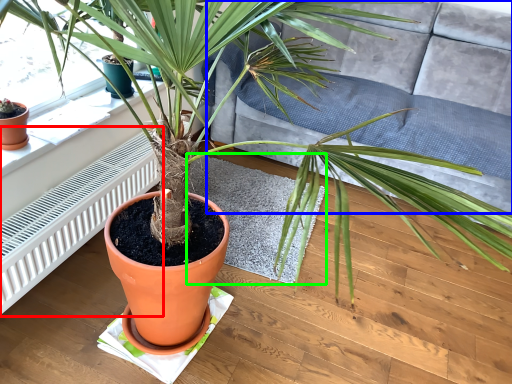
Question: Which object is positioned farthest from radiator (highlighted by a red box)? Select from couch (highlighted by a blue box) and mat (highlighted by a green box).

Choices:
 (A) couch
 (B) mat

Answer: (A)